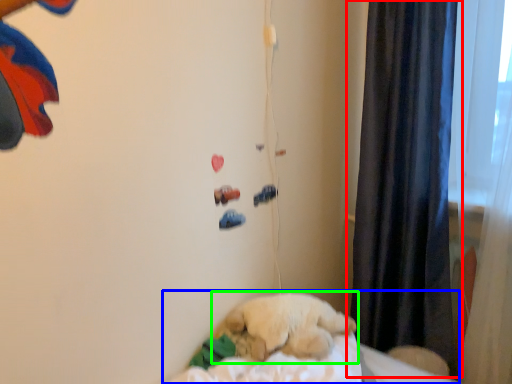
Question: Based on their relative distances, which object is nearer to curtain (highlighted by a red box)? Choose from bed (highlighted by a blue box) and dog (highlighted by a green box).

Choices:
 (A) bed
 (B) dog

Answer: (B)